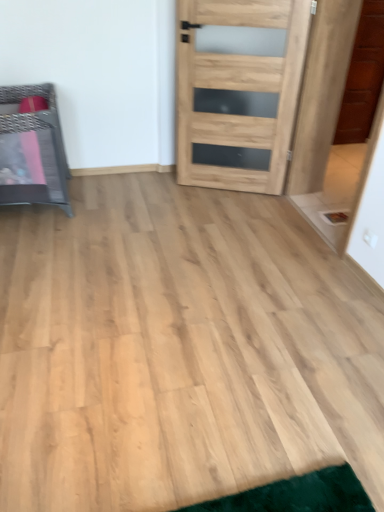
Where is `natural wood door at center`? This screenshot has height=512, width=384. natural wood door at center is located at coordinates (238, 90).

This screenshot has height=512, width=384. Describe the element at coordinates (238, 90) in the screenshot. I see `natural wood door at center` at that location.

Describe the element at coordinates (32, 150) in the screenshot. I see `metallic woven basket at left` at that location.

What is the approximate height of metallic woven basket at left?

The height of metallic woven basket at left is 29.71 inches.

The image size is (384, 512). What are the coordinates of `metallic woven basket at left` in the screenshot? It's located at (32, 150).

Identify the location of natural wood door at center. (238, 90).

Considering the relative positions of metallic woven basket at left and natural wood door at center in the image provided, is metallic woven basket at left to the right of natural wood door at center from the viewer's perspective?

No.

In the scene shown: In the image, is metallic woven basket at left positioned in front of or behind natural wood door at center?

metallic woven basket at left is in front of natural wood door at center.

Considering the positions of points (66, 179) and (271, 80), is point (66, 179) closer to camera compared to point (271, 80)?

No, it is not.

From the image's perspective, which object appears higher, metallic woven basket at left or natural wood door at center?

From the image's view, natural wood door at center is above.

From a real-world perspective, is metallic woven basket at left positioned above or below natural wood door at center?

metallic woven basket at left is below natural wood door at center.

Considering the relative sizes of metallic woven basket at left and natural wood door at center in the image provided, is metallic woven basket at left thinner than natural wood door at center?

No, metallic woven basket at left is not thinner than natural wood door at center.

From their relative heights in the image, would you say metallic woven basket at left is taller or shorter than natural wood door at center?

Clearly, metallic woven basket at left is shorter compared to natural wood door at center.

Considering the sizes of objects metallic woven basket at left and natural wood door at center in the image provided, who is smaller, metallic woven basket at left or natural wood door at center?

natural wood door at center is smaller.

Do you think metallic woven basket at left is within natural wood door at center, or outside of it?

metallic woven basket at left is located beyond the bounds of natural wood door at center.

Is metallic woven basket at left far from natural wood door at center?

That's right, there is a large distance between metallic woven basket at left and natural wood door at center.

Could you tell me if metallic woven basket at left is facing natural wood door at center?

No, metallic woven basket at left does not turn towards natural wood door at center.

I want to click on door on the right of the metallic woven basket at left, so click(x=238, y=90).

Is natural wood door at center to the left of metallic woven basket at left from the viewer's perspective?

No, natural wood door at center is not to the left of metallic woven basket at left.

Which object is further away from the camera taking this photo, natural wood door at center or metallic woven basket at left?

natural wood door at center.

Is point (204, 23) farther from viewer compared to point (57, 147)?

No, it is in front of (57, 147).

From the image's perspective, is natural wood door at center positioned above or below metallic woven basket at left?

natural wood door at center is above metallic woven basket at left.

Looking at this image, from a real-world perspective, which object rests below the other?

metallic woven basket at left.

Which of these two, natural wood door at center or metallic woven basket at left, is thinner?

natural wood door at center.

In terms of height, does natural wood door at center look taller or shorter compared to metallic woven basket at left?

natural wood door at center is taller than metallic woven basket at left.

Considering the sizes of objects natural wood door at center and metallic woven basket at left in the image provided, who is smaller, natural wood door at center or metallic woven basket at left?

natural wood door at center.

Is metallic woven basket at left a part of natural wood door at center?

No, natural wood door at center does not contain metallic woven basket at left.

Would you consider natural wood door at center to be distant from metallic woven basket at left?

Indeed, natural wood door at center is not near metallic woven basket at left.

Does natural wood door at center turn towards metallic woven basket at left?

No, natural wood door at center is not turned towards metallic woven basket at left.

How many degrees apart are the facing directions of natural wood door at center and metallic woven basket at left?

24.2 degrees.

How distant is natural wood door at center from metallic woven basket at left?

natural wood door at center is 3.92 feet from metallic woven basket at left.

At what (x,y) coordinates should I click in order to perform the action: click on door above the metallic woven basket at left (from the image's perspective). Please return your answer as a coordinate pair (x, y). Looking at the image, I should click on (238, 90).

Where is `furniture in front of the natural wood door at center`? furniture in front of the natural wood door at center is located at coordinates (32, 150).

This screenshot has width=384, height=512. I want to click on door above the metallic woven basket at left (from a real-world perspective), so click(x=238, y=90).